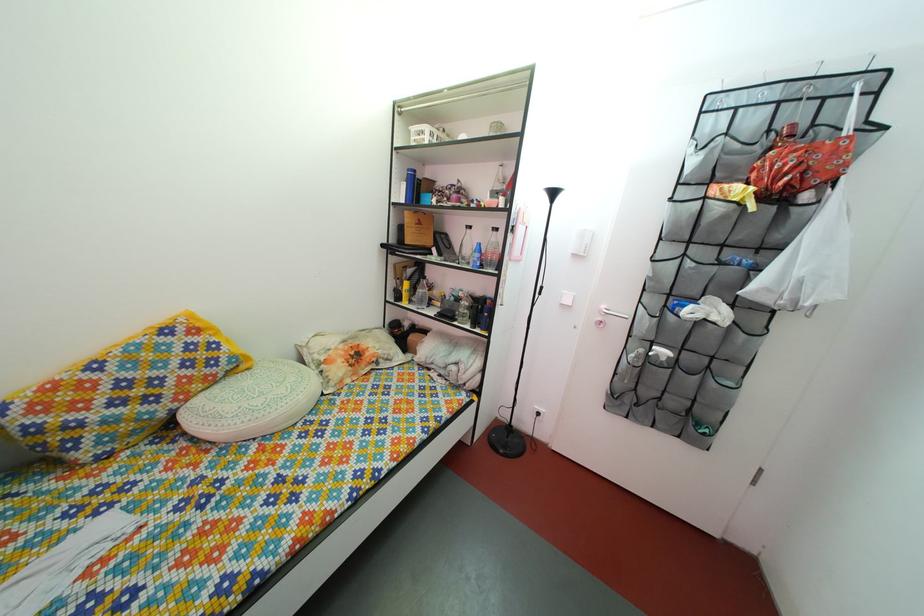
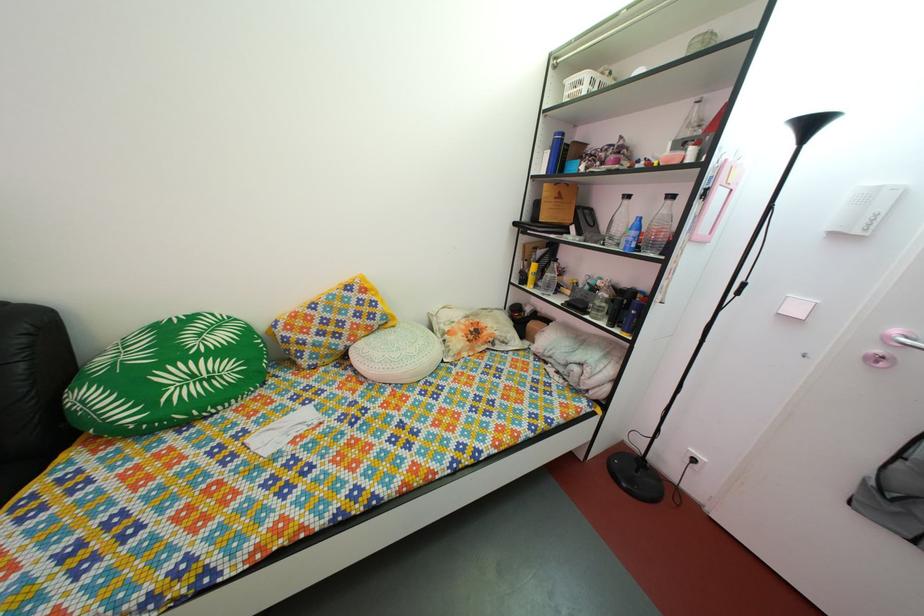
Question: I am providing you with two images of the same scene from different viewpoints. Please identify which objects are invisible in image2.

Choices:
 (A) black spray can
 (B) white light switch
 (C) glass carafe bottle
 (D) none of these

Answer: (D)